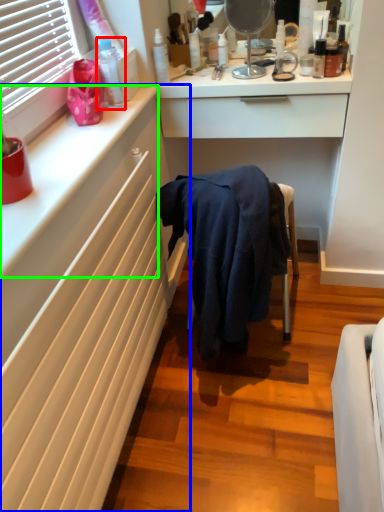
Question: Based on their relative distances, which object is nearer to toiletry (highlighted by a red box)? Choose from cabinetry (highlighted by a blue box) and counter top (highlighted by a green box).

Choices:
 (A) cabinetry
 (B) counter top

Answer: (B)